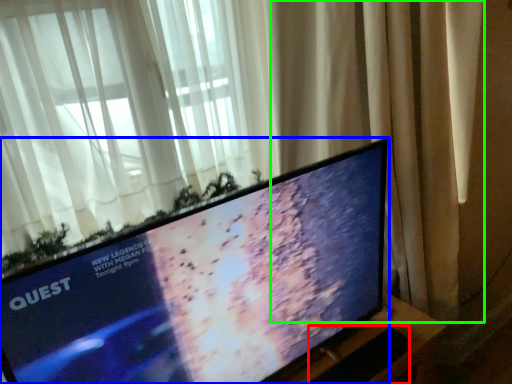
Question: Which is nearer to the laptop keyboard (highlighted by a red box)? television (highlighted by a blue box) or curtain (highlighted by a green box).

Choices:
 (A) television
 (B) curtain

Answer: (A)